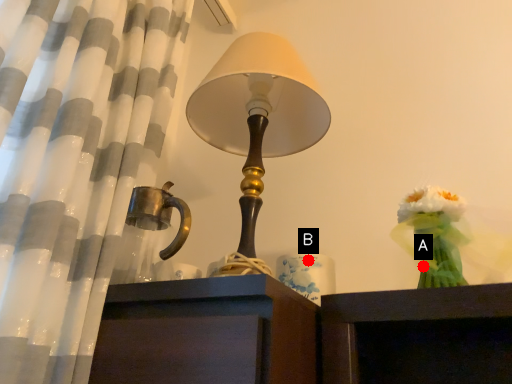
Question: Two points are circled on the image, labeled by A and B beside each circle. Which of the following is the farthest from the observer?

Choices:
 (A) A is further
 (B) B is further

Answer: (B)